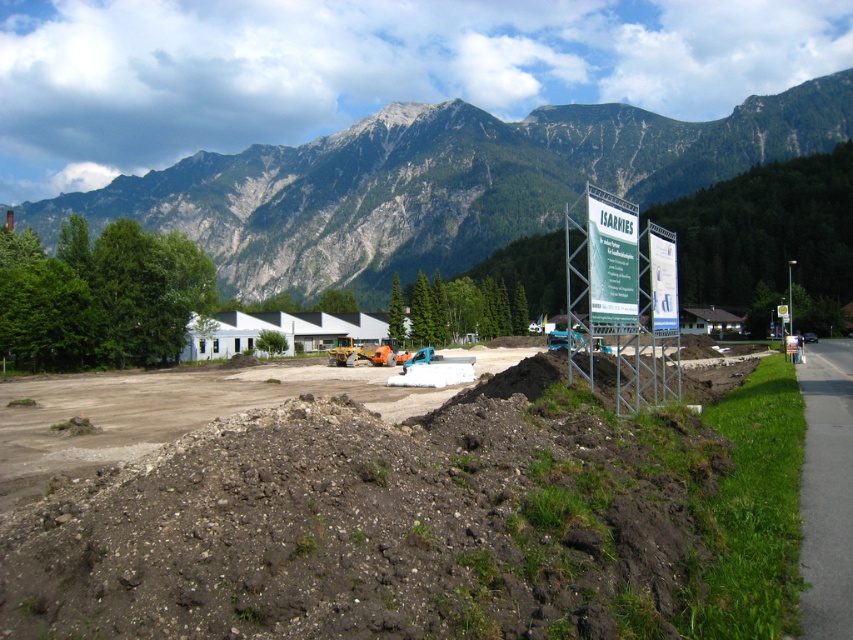
Question: Which object is closer to the camera taking this photo?

Choices:
 (A) brown soil at center
 (B) rocky gray mountain at upper center

Answer: (A)

Question: Does brown soil at center have a greater width compared to rocky gray mountain at upper center?

Choices:
 (A) yes
 (B) no

Answer: (B)

Question: Which point appears closest to the camera in this image?

Choices:
 (A) (341, 141)
 (B) (252, 461)

Answer: (B)

Question: Is brown soil at center positioned in front of rocky gray mountain at upper center?

Choices:
 (A) no
 (B) yes

Answer: (B)

Question: Is brown soil at center to the left of rocky gray mountain at upper center from the viewer's perspective?

Choices:
 (A) yes
 (B) no

Answer: (B)

Question: Which of the following is the closest to the observer?

Choices:
 (A) rocky gray mountain at upper center
 (B) brown soil at center

Answer: (B)